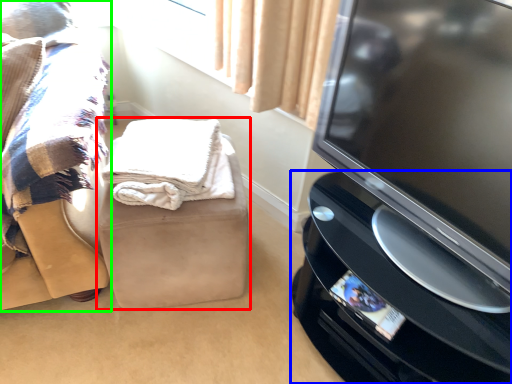
Question: Which object is the closest to the furniture (highlighted by a red box)? Choose among these: home appliance (highlighted by a blue box) or furniture (highlighted by a green box).

Choices:
 (A) home appliance
 (B) furniture

Answer: (B)